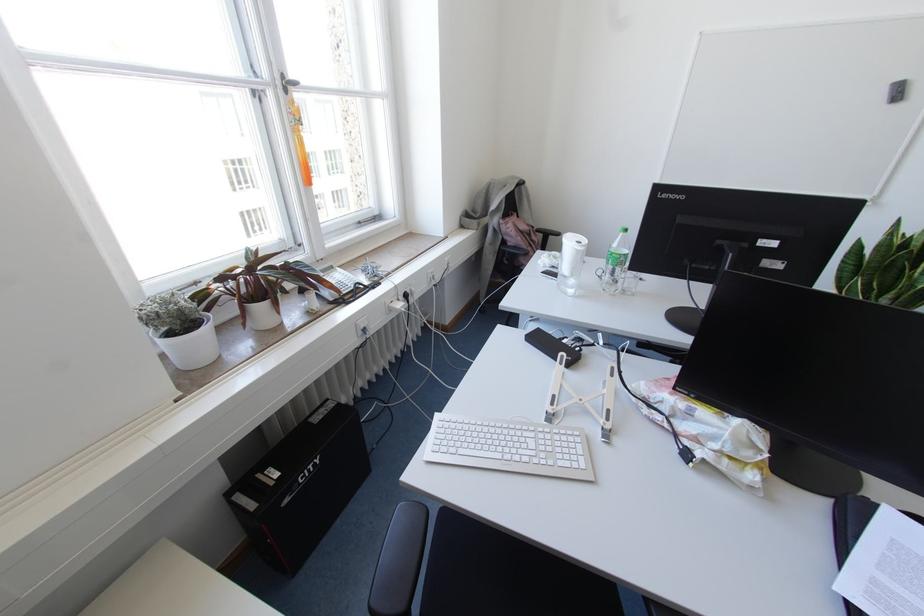
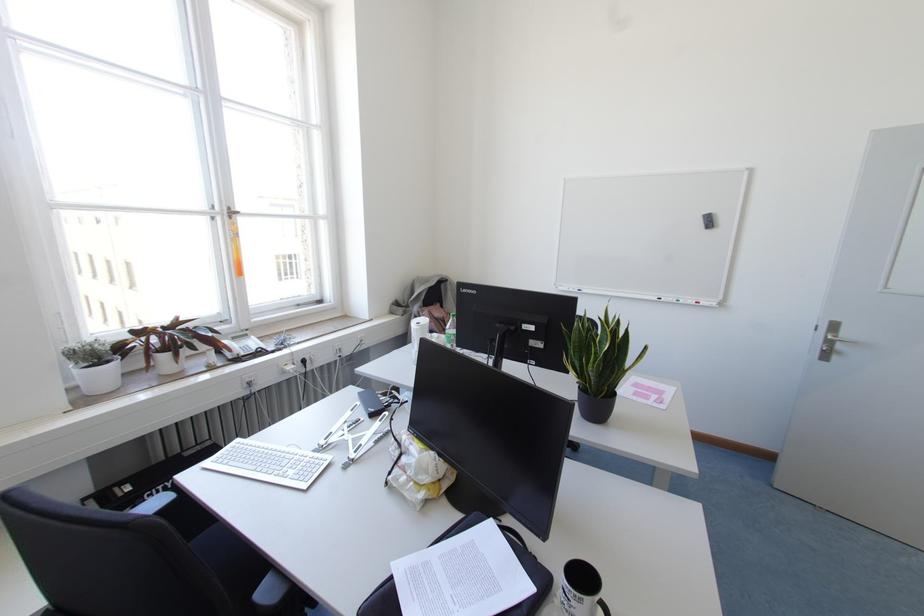
Where in the second image is the point corresponding to pixel 357 285 from the first image?

(258, 349)